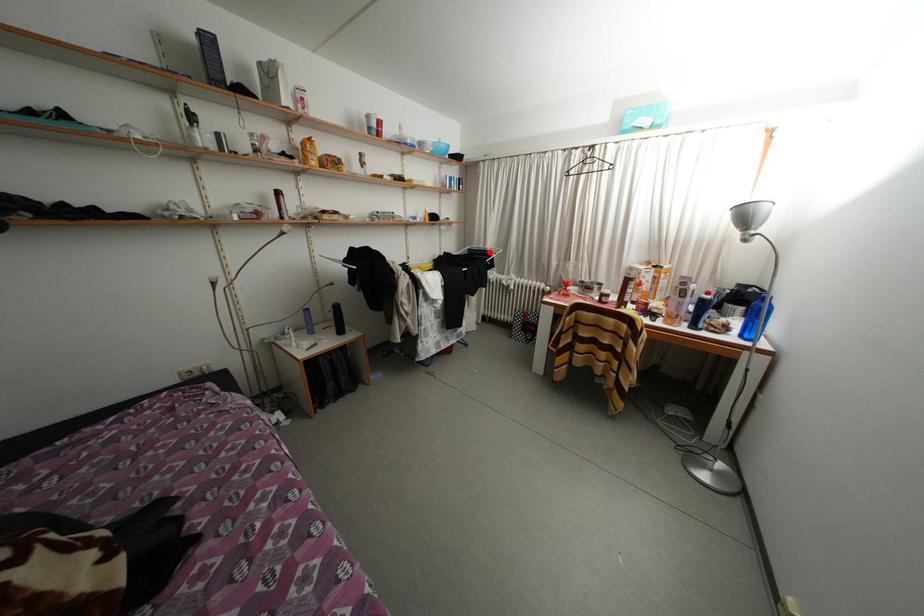
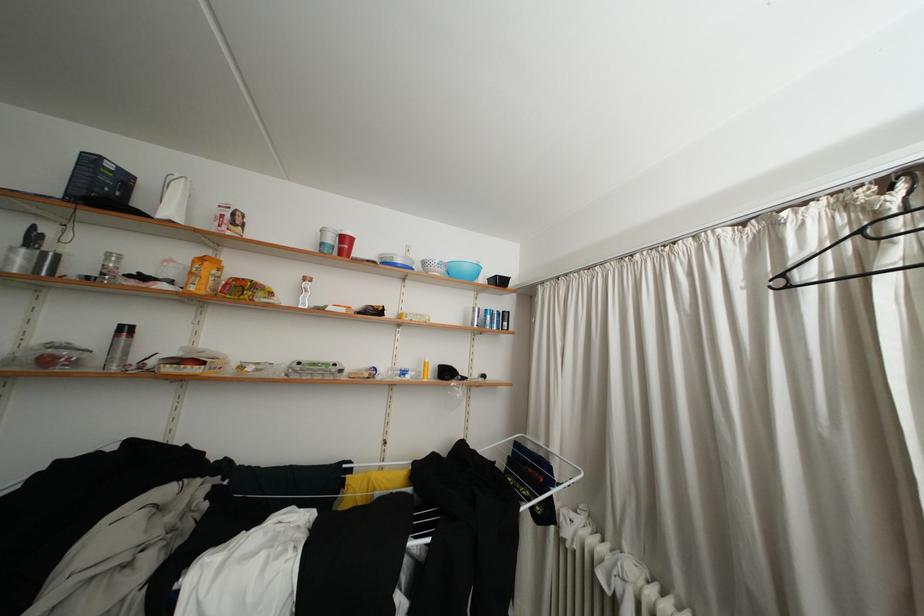
The point at the highlighted location is marked in the first image. Where is the corresponding point in the second image?

(550, 448)